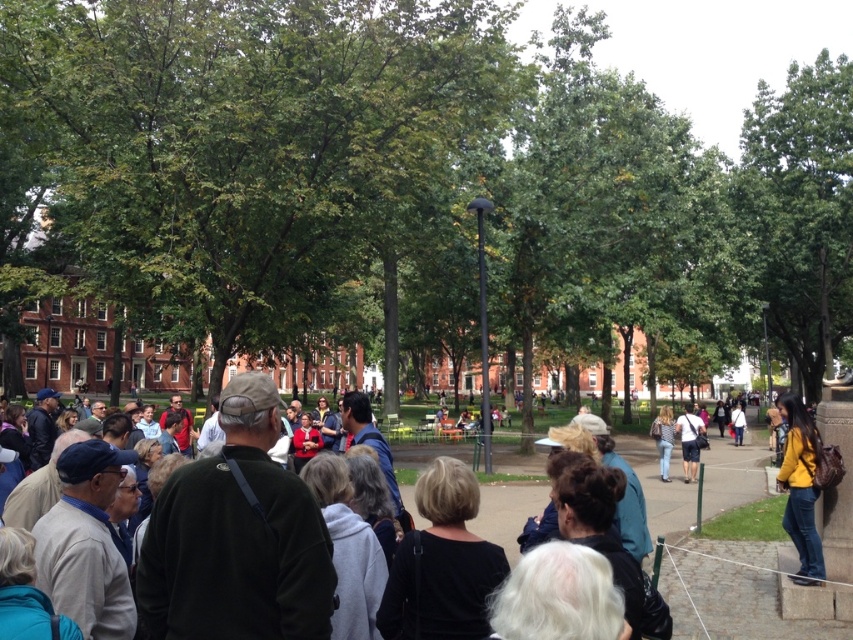
You are standing at the starting point of the pathway in the park. You see two points marked in the scene. The first point is at coordinates point (463, 481) and the second is at point (697, 460). If you were to walk towards the red brick buildings in the background, which point would you encounter first?

Point (463, 481) is in front of point (697, 460), so you would encounter point (463, 481) first as you walk towards the red brick buildings in the background.

You are a photographer trying to capture a clear shot of the denim shorts at center without any obstructions. Given the presence of the green leafy tree at upper right, what adjustment should you make to your position?

The denim shorts at center is behind the green leafy tree at upper right, so you should move to a position where the green leafy tree at upper right is between you and the denim shorts at center, allowing you to see the denim shorts at center clearly by moving around the tree.